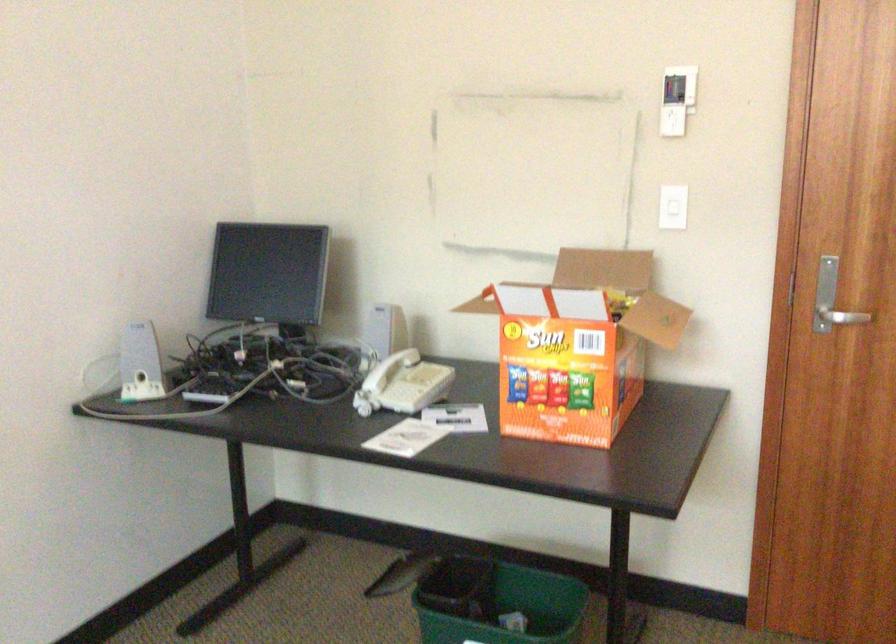
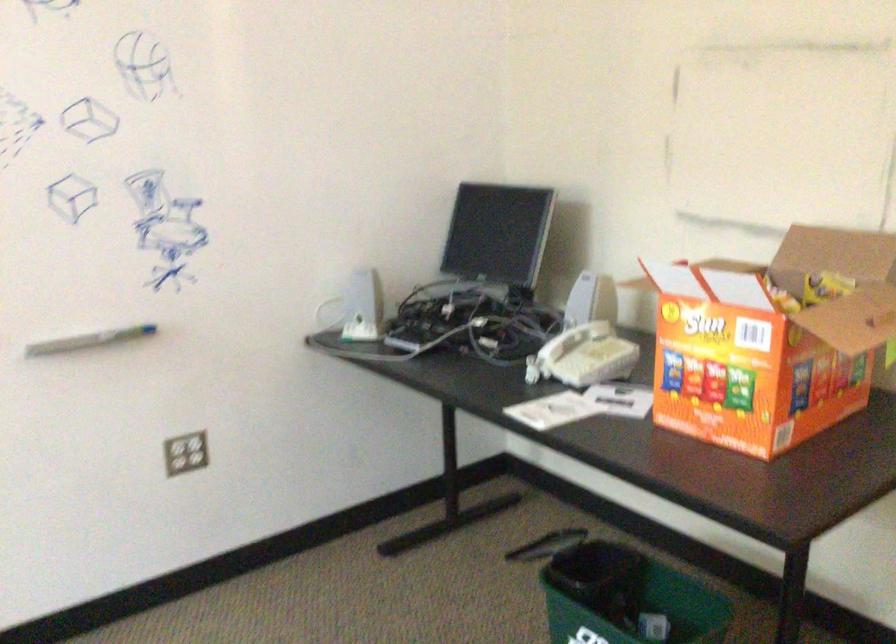
Find the pixel in the second image that matches point (149, 361) in the first image.

(355, 308)